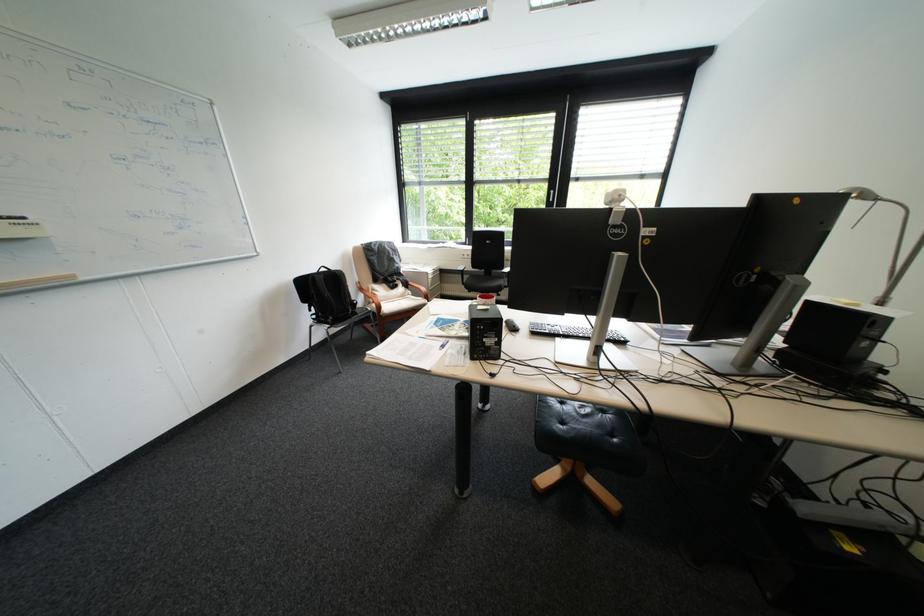
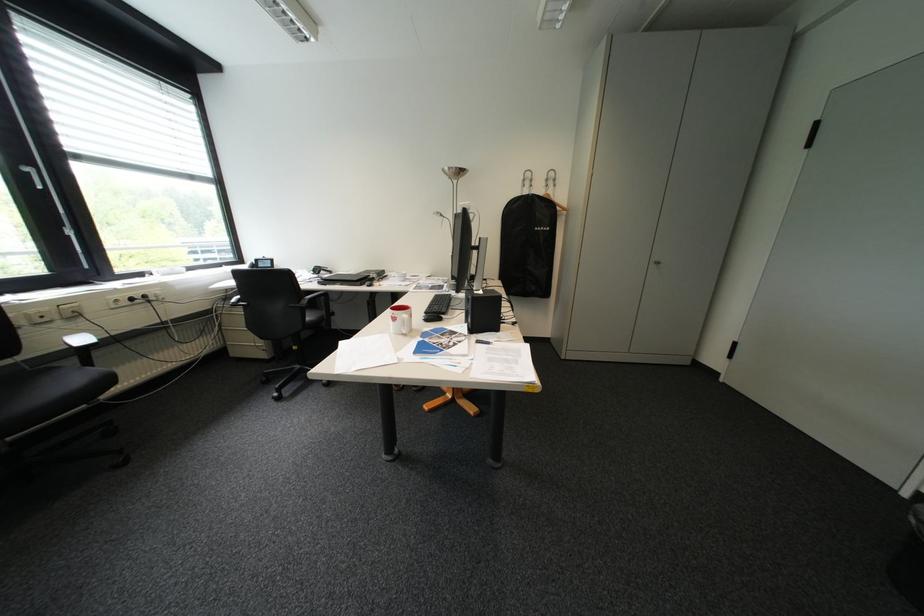
In the second image, find the point that corresponds to [564,192] in the first image.

(41, 169)